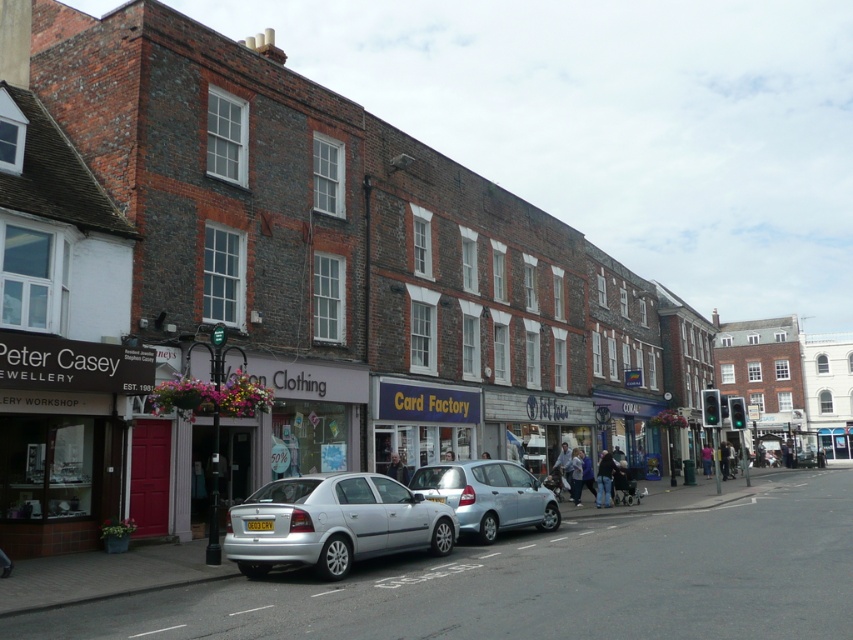
Can you confirm if silver metallic hatchback at center is positioned below light blue jeans at center?

Actually, silver metallic hatchback at center is above light blue jeans at center.

Which is below, silver metallic hatchback at center or light blue jeans at center?

Positioned lower is light blue jeans at center.

Is point (456, 496) positioned before point (578, 458)?

Yes, it is.

Image resolution: width=853 pixels, height=640 pixels. What are the coordinates of `silver metallic hatchback at center` in the screenshot? It's located at (489, 497).

Which is behind, point (285, 484) or point (490, 508)?

The point (490, 508) is behind.

Does point (360, 557) lie behind point (473, 506)?

No, (360, 557) is in front of (473, 506).

Where is `silver metallic car at center`? Image resolution: width=853 pixels, height=640 pixels. silver metallic car at center is located at coordinates (334, 524).

Does dark blue jeans at center have a smaller size compared to light brown leather jacket at center?

Actually, dark blue jeans at center might be larger than light brown leather jacket at center.

Does dark blue jeans at center come behind light brown leather jacket at center?

Yes.

In order to click on dark blue jeans at center in this screenshot , I will do click(604, 480).

What are the coordinates of `dark blue jeans at center` in the screenshot? It's located at (604, 480).